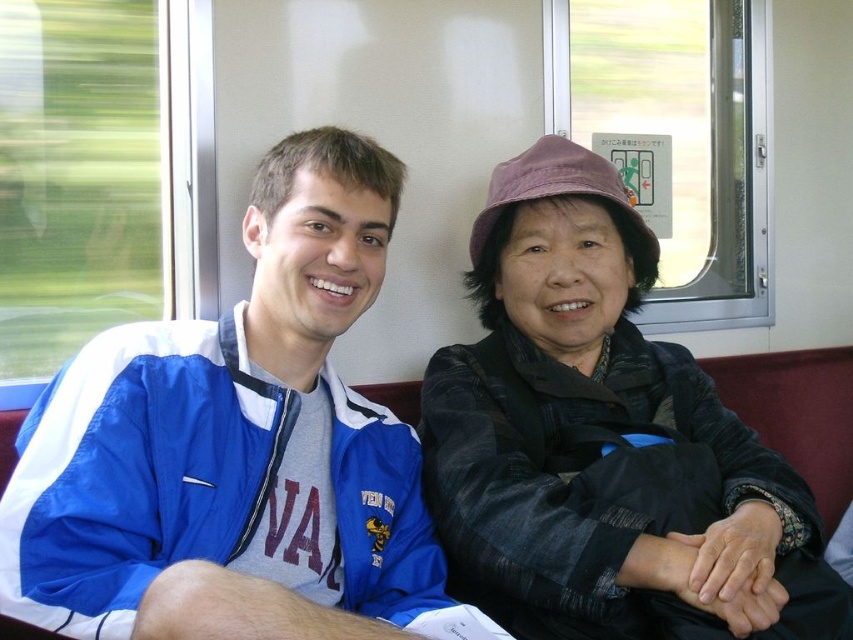
Question: Does blue nylon jacket at left have a lesser width compared to dark gray textured jacket at center?

Choices:
 (A) no
 (B) yes

Answer: (B)

Question: Does blue nylon jacket at left lie in front of dark gray textured jacket at center?

Choices:
 (A) yes
 (B) no

Answer: (A)

Question: Among these points, which one is nearest to the camera?

Choices:
 (A) (109, 566)
 (B) (643, 417)

Answer: (A)

Question: Is blue nylon jacket at left above dark gray textured jacket at center?

Choices:
 (A) yes
 (B) no

Answer: (A)

Question: Which of the following is the farthest from the observer?

Choices:
 (A) dark gray textured jacket at center
 (B) blue nylon jacket at left

Answer: (A)

Question: Among these objects, which one is farthest from the camera?

Choices:
 (A) dark gray textured jacket at center
 (B) blue nylon jacket at left

Answer: (A)